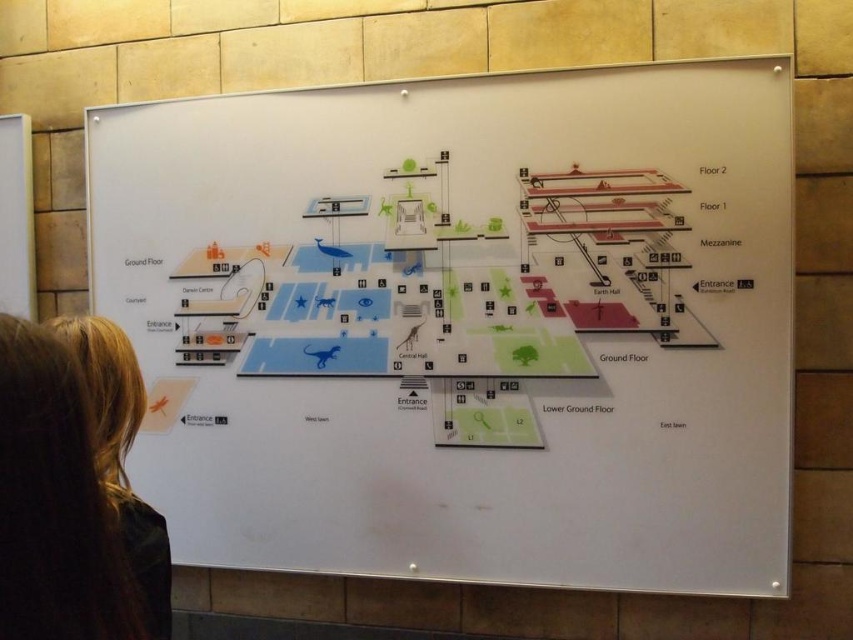
Question: Which object is closer to the camera taking this photo?

Choices:
 (A) blonde hair at lower left
 (B) white paper map at upper center

Answer: (A)

Question: Is the position of white paper map at upper center less distant than that of blonde hair at lower left?

Choices:
 (A) yes
 (B) no

Answer: (B)

Question: Can you confirm if white paper map at upper center is bigger than blonde hair at lower left?

Choices:
 (A) no
 (B) yes

Answer: (B)

Question: Can you confirm if white paper map at upper center is thinner than blonde hair at lower left?

Choices:
 (A) no
 (B) yes

Answer: (A)